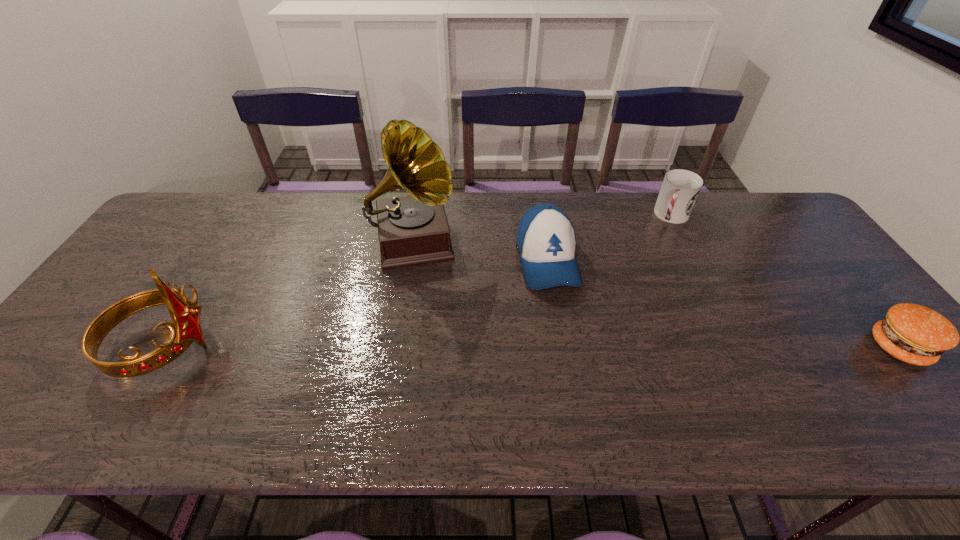
You are a GUI agent. You are given a task and a screenshot of the screen. Output one action in this format:
    pyautogui.click(x=<x>, y=<y>)
    Task: Click on the free space on the desktop that is between the tiara and the shortest object and is positioned on the front-facing side of the baseball cap
    
    Given the screenshot: What is the action you would take?
    pyautogui.click(x=573, y=347)

This screenshot has width=960, height=540. Find the location of `free spot on the desktop that is between the second tallest object and the rightmost object and is positioned on the handle side of the cup`. free spot on the desktop that is between the second tallest object and the rightmost object and is positioned on the handle side of the cup is located at coordinates (604, 347).

This screenshot has width=960, height=540. I want to click on vacant space on the desktop that is between the tiara and the shortest object and is positioned from the horn of the fourth object from right to left, so click(432, 347).